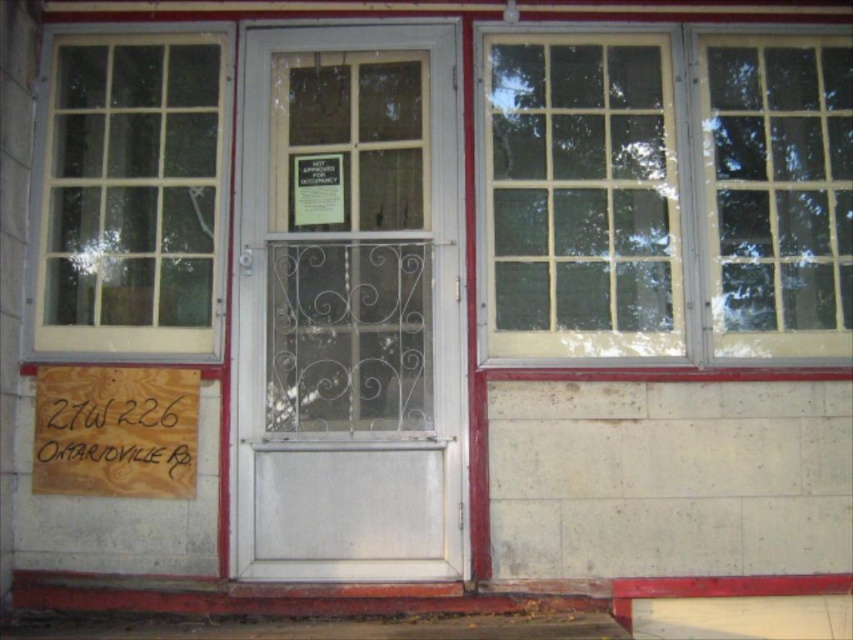
Question: Is clear glass window at upper right to the right of wooden sign at lower left from the viewer's perspective?

Choices:
 (A) no
 (B) yes

Answer: (B)

Question: Does matte glass window at left appear over wooden sign at lower left?

Choices:
 (A) yes
 (B) no

Answer: (A)

Question: Considering the real-world distances, which object is closest to the matte gray door at center?

Choices:
 (A) clear glass window at upper right
 (B) wooden sign at lower left
 (C) matte glass window at left
 (D) matte glass window at upper right

Answer: (C)

Question: Is matte gray door at center above wooden sign at lower left?

Choices:
 (A) no
 (B) yes

Answer: (B)

Question: Which of the following is the farthest from the observer?

Choices:
 (A) (724, 80)
 (B) (364, 563)

Answer: (A)

Question: Which object appears farthest from the camera in this image?

Choices:
 (A) matte glass window at left
 (B) wooden sign at lower left

Answer: (A)